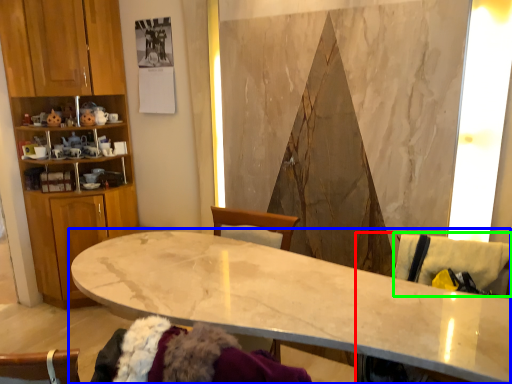
Question: Estimate the real-world distances between objects in this image. Which object is farther from swivel chair (highlighted by a red box), countertop (highlighted by a blue box) or swivel chair (highlighted by a green box)?

Choices:
 (A) countertop
 (B) swivel chair

Answer: (B)